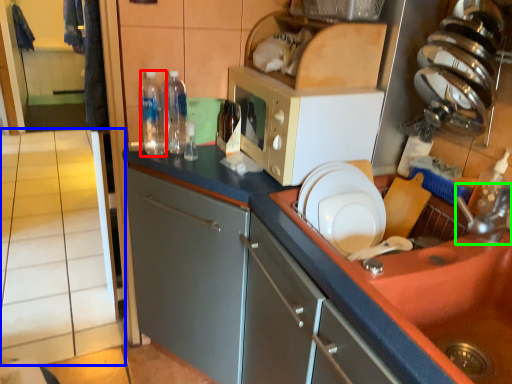
Question: Estimate the real-world distances between objects in this image. Which object is farther from bottle (highlighted by a red box), tile (highlighted by a blue box) or faucet (highlighted by a green box)?

Choices:
 (A) tile
 (B) faucet

Answer: (A)